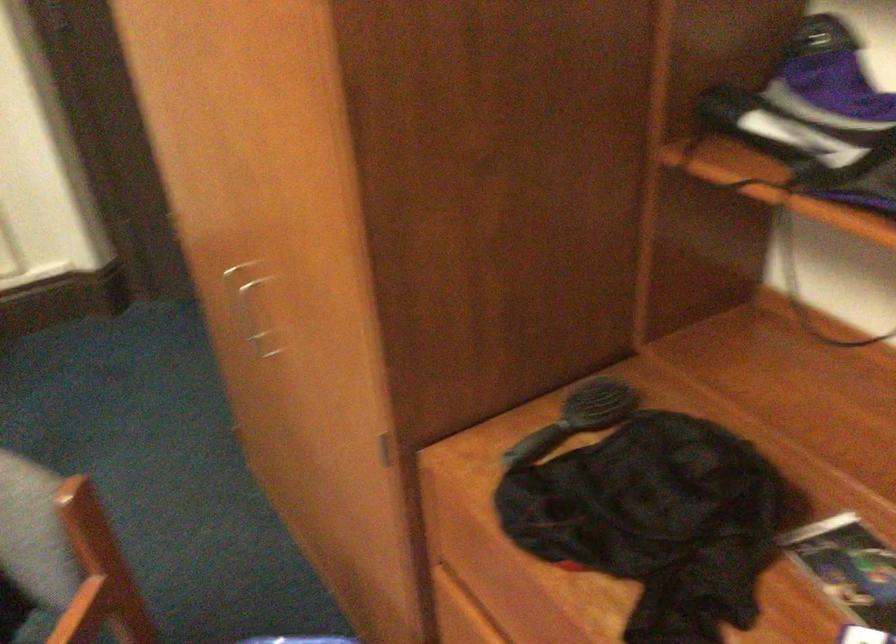
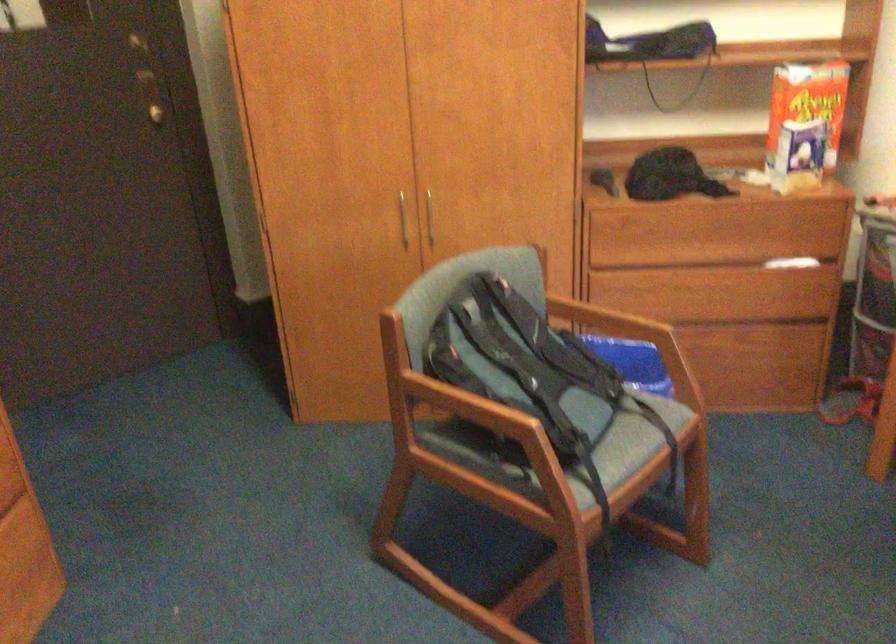
The point at [261,313] is marked in the first image. Where is the corresponding point in the second image?

(402, 220)